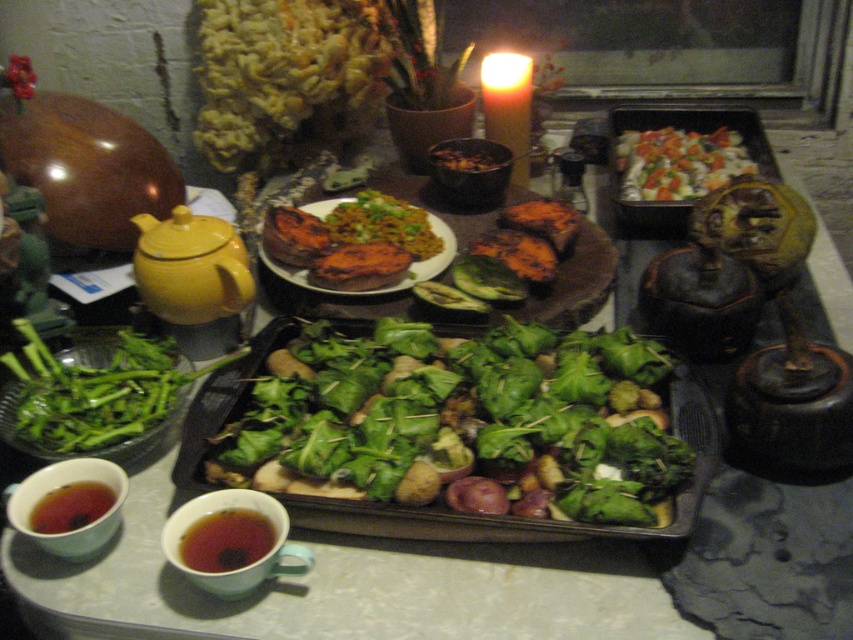
Can you confirm if chopped tomato salad at center is positioned above brown matte cup at lower left?

Yes.

Find the location of `chopped tomato salad at center`. chopped tomato salad at center is located at coordinates (677, 163).

Who is more forward, (x=624, y=173) or (x=257, y=532)?

Point (x=257, y=532) is more forward.

Where is `chopped tomato salad at center`? The image size is (853, 640). chopped tomato salad at center is located at coordinates (677, 163).

Which is below, green leafy vegetable at lower left or grilled sweet potato at center?

green leafy vegetable at lower left is lower down.

Which is more to the right, green leafy vegetable at lower left or grilled sweet potato at center?

grilled sweet potato at center

This screenshot has height=640, width=853. I want to click on green leafy vegetable at lower left, so click(94, 392).

Can you confirm if green leafymaterial/texturevegetable at center is thinner than green leafy vegetable at lower left?

No.

Does green leafymaterial/texturevegetable at center lie in front of green leafy vegetable at lower left?

That is True.

This screenshot has height=640, width=853. In order to click on green leafymaterial/texturevegetable at center in this screenshot , I will do `click(457, 422)`.

What are the coordinates of `green leafymaterial/texturevegetable at center` in the screenshot? It's located at (457, 422).